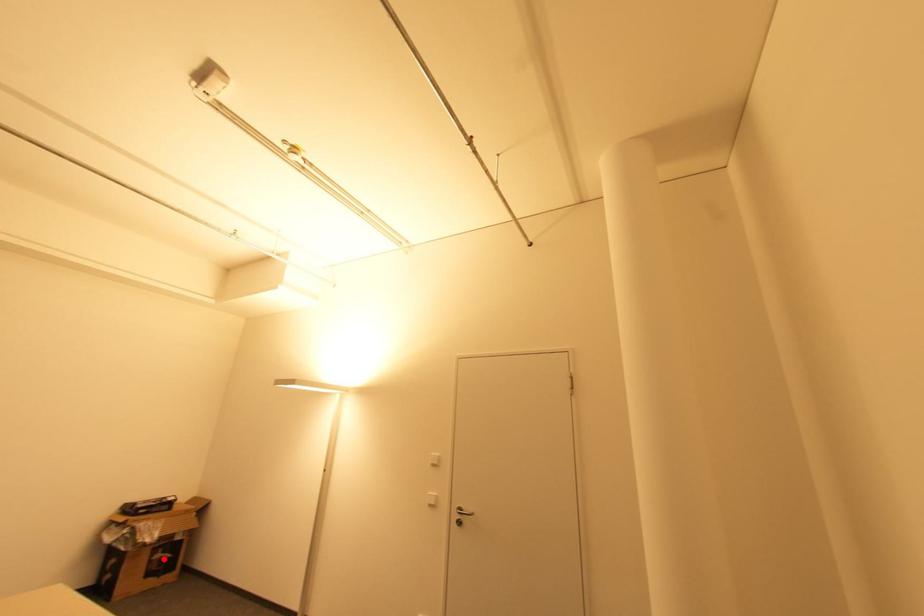
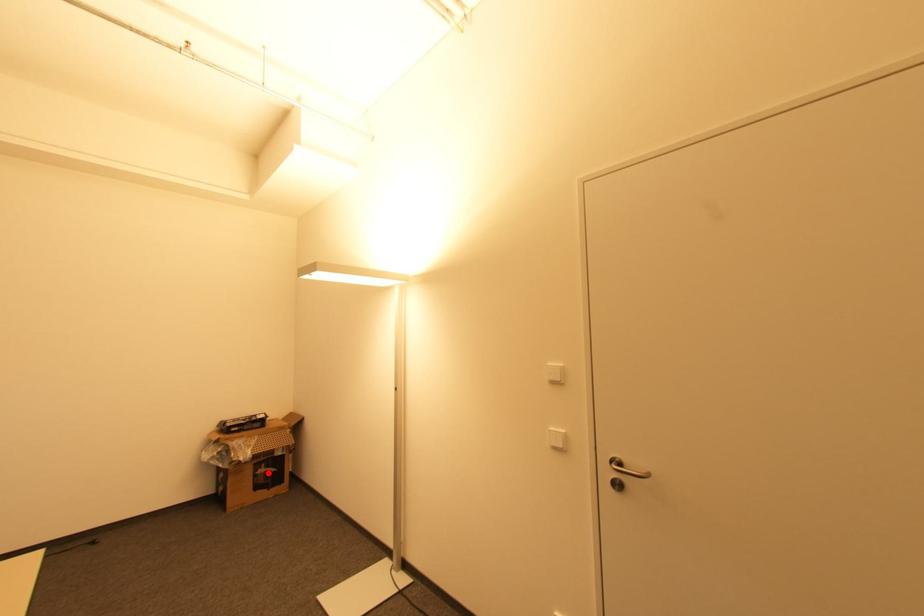
I am providing you with two images of the same scene from different viewpoints. A red point is marked on the first image and another point is marked on the second image. Are the points marked in image1 and image2 representing the same 3D position?

Yes